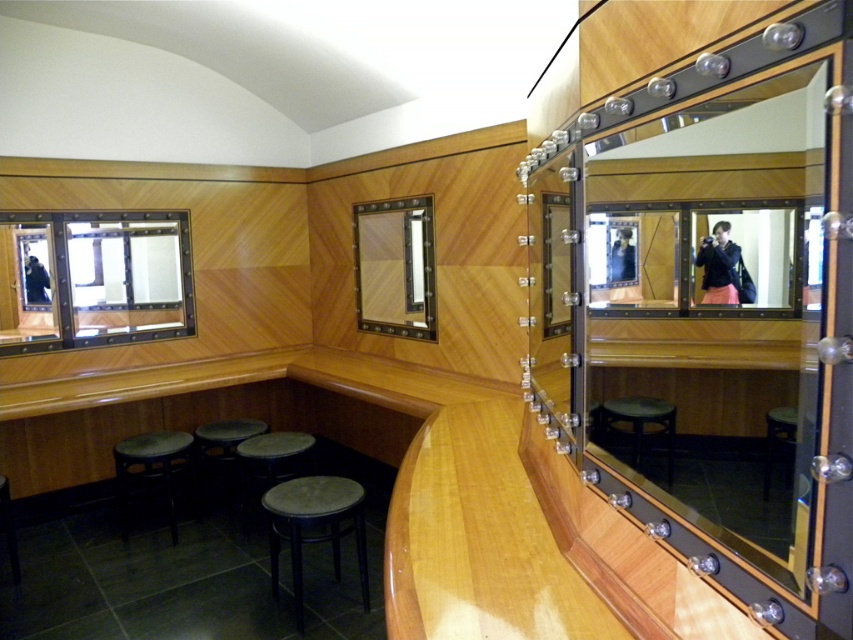
Is dark brown leather stool at center bigger than matte black jacket at center?

Correct, dark brown leather stool at center is larger in size than matte black jacket at center.

Is dark brown leather stool at center in front of matte black jacket at center?

No, it is behind matte black jacket at center.

I want to click on dark brown leather stool at center, so click(314, 525).

At what (x,y) coordinates should I click in order to perform the action: click on dark brown leather stool at center. Please return your answer as a coordinate pair (x, y). Looking at the image, I should click on (314, 525).

Is matte wooden mirror at center taller than matte black jacket at center?

Yes, matte wooden mirror at center is taller than matte black jacket at center.

Is matte wooden mirror at center above matte black jacket at center?

Yes.

What do you see at coordinates (393, 268) in the screenshot? This screenshot has height=640, width=853. I see `matte wooden mirror at center` at bounding box center [393, 268].

Find the location of a particular element. This screenshot has height=640, width=853. matte wooden mirror at center is located at coordinates (393, 268).

Between matte black mirror at left and dark brown wooden stool at center, which one appears on the right side from the viewer's perspective?

dark brown wooden stool at center is more to the right.

Is matte black mirror at left wider than dark brown wooden stool at center?

Yes, matte black mirror at left is wider than dark brown wooden stool at center.

Identify the location of matte black mirror at left. Image resolution: width=853 pixels, height=640 pixels. (91, 280).